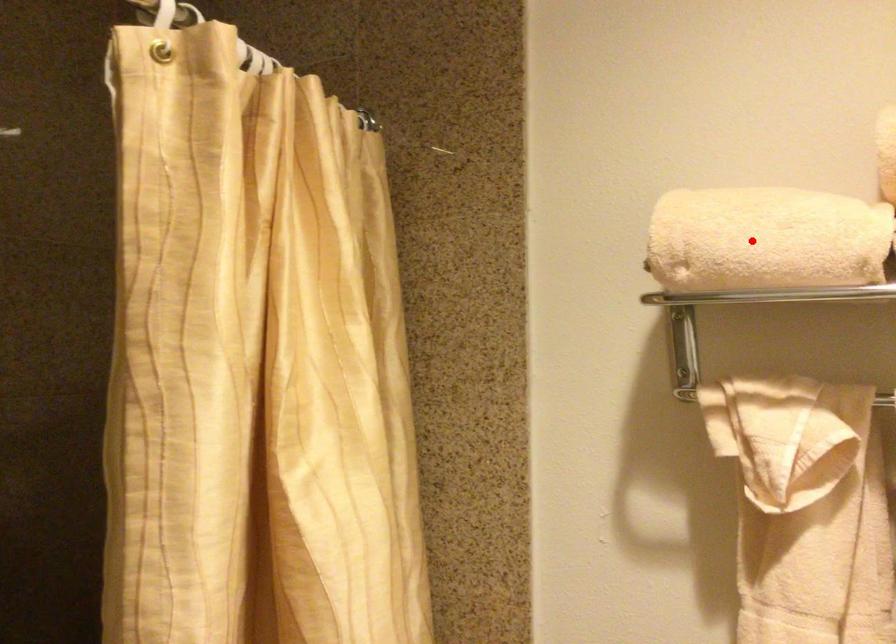
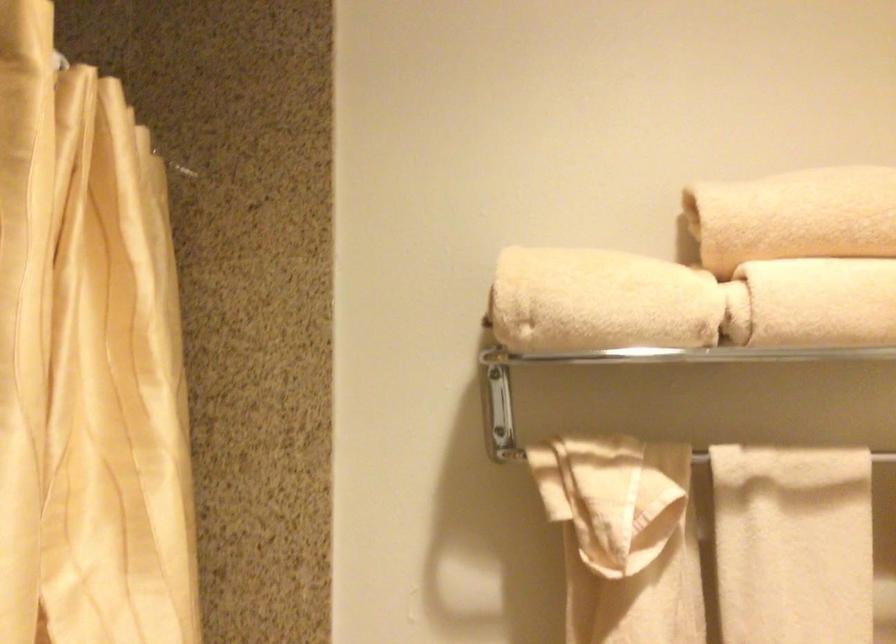
Find the pixel in the second image that matches the highlighted location in the first image.

(599, 301)